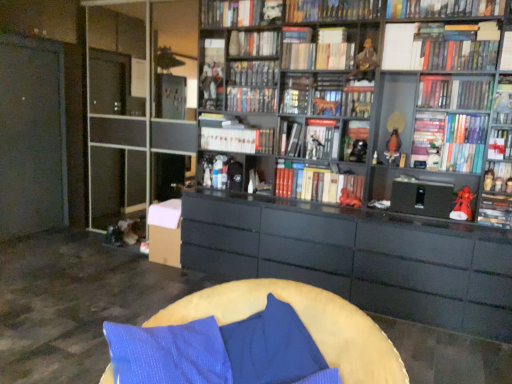
Question: Is there a large distance between matte black figurine at right, acting as the seventeenth book starting from the top, and black matte bookshelf at center, which appears as the 9th book when viewed from the top?

Choices:
 (A) yes
 (B) no

Answer: (A)

Question: Is matte black figurine at right, the 3th book from the bottom, thinner than black matte bookshelf at center, which appears as the 9th book when viewed from the top?

Choices:
 (A) yes
 (B) no

Answer: (A)

Question: Does matte black figurine at right, the 3th book from the bottom, appear on the left side of black matte bookshelf at center, which appears as the 9th book when viewed from the top?

Choices:
 (A) yes
 (B) no

Answer: (B)

Question: From the image's perspective, does matte black figurine at right, the 3th book from the bottom, appear lower than black matte bookshelf at center, which appears as the eleventh book when ordered from the bottom?

Choices:
 (A) no
 (B) yes

Answer: (B)

Question: Is matte black figurine at right, the 3th book from the bottom, facing towards black matte bookshelf at center, which appears as the 9th book when viewed from the top?

Choices:
 (A) yes
 (B) no

Answer: (B)

Question: From the image's perspective, relative to hardcover book at upper center, arranged as the 4th book when viewed from the top, is matte black figurine at right, the 3th book from the bottom, above or below?

Choices:
 (A) below
 (B) above

Answer: (A)

Question: Is matte black figurine at right, acting as the seventeenth book starting from the top, in front of or behind hardcover book at upper center, arranged as the 4th book when viewed from the top, in the image?

Choices:
 (A) behind
 (B) front

Answer: (B)

Question: Visually, is matte black figurine at right, acting as the seventeenth book starting from the top, positioned to the left or to the right of hardcover book at upper center, arranged as the 4th book when viewed from the top?

Choices:
 (A) left
 (B) right

Answer: (B)

Question: Which is correct: matte black figurine at right, the 3th book from the bottom, is inside hardcover book at upper center, which is counted as the 16th book, starting from the bottom, or outside of it?

Choices:
 (A) outside
 (B) inside

Answer: (A)

Question: Choose the correct answer: Is matte black figurine at right, acting as the seventeenth book starting from the top, inside matte red figurine at right or outside it?

Choices:
 (A) inside
 (B) outside

Answer: (B)

Question: From a real-world perspective, is matte black figurine at right, the 3th book from the bottom, physically located above or below matte red figurine at right?

Choices:
 (A) below
 (B) above

Answer: (B)

Question: Looking at the image, does matte black figurine at right, the 3th book from the bottom, seem bigger or smaller compared to matte red figurine at right?

Choices:
 (A) small
 (B) big

Answer: (B)

Question: Relative to matte red figurine at right, is matte black figurine at right, the 3th book from the bottom, in front or behind?

Choices:
 (A) front
 (B) behind

Answer: (A)

Question: Considering the positions of white glossy book at upper right, which ranks as the 4th book in bottom-to-top order, and hardcover book at upper center, acting as the 1th book starting from the top, in the image, is white glossy book at upper right, which ranks as the 4th book in bottom-to-top order, bigger or smaller than hardcover book at upper center, acting as the 1th book starting from the top,?

Choices:
 (A) small
 (B) big

Answer: (A)

Question: From a real-world perspective, is white glossy book at upper right, which ranks as the 4th book in bottom-to-top order, physically located above or below hardcover book at upper center, arranged as the 19th book when ordered from the bottom?

Choices:
 (A) below
 (B) above

Answer: (A)